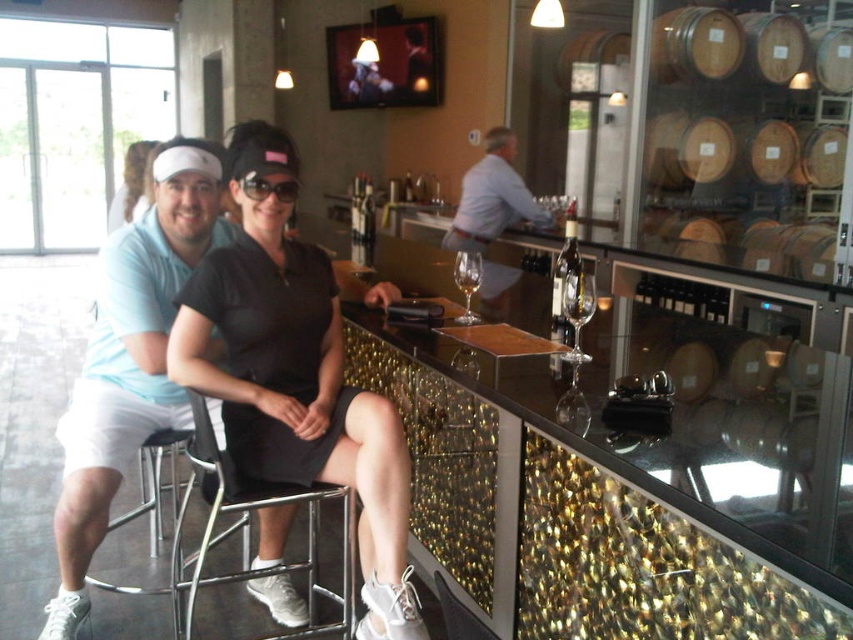
Is clear glass wine glass at center taller than clear glass wine at bar center?

Yes, clear glass wine glass at center is taller than clear glass wine at bar center.

From the picture: Is clear glass wine glass at center above clear glass wine at bar center?

Actually, clear glass wine glass at center is below clear glass wine at bar center.

Between point (585, 356) and point (454, 278), which one is positioned behind?

Point (454, 278)

I want to click on clear glass wine glass at center, so click(577, 308).

From the picture: How far apart are light blue shirt at center and clear glass wine glass at center?

light blue shirt at center is 9.92 feet away from clear glass wine glass at center.

Who is shorter, light blue shirt at center or clear glass wine glass at center?

Standing shorter between the two is clear glass wine glass at center.

Measure the distance between light blue shirt at center and camera.

They are 4.91 meters apart.

The image size is (853, 640). Find the location of `light blue shirt at center`. light blue shirt at center is located at coordinates (492, 196).

Does point (175, 260) come in front of point (560, 292)?

Yes.

Is light blue polo shirt at left to the right of translucent glass bottle at center from the viewer's perspective?

Incorrect, light blue polo shirt at left is not on the right side of translucent glass bottle at center.

Who is more forward, (119, 269) or (556, 301)?

Positioned in front is point (119, 269).

This screenshot has height=640, width=853. Find the location of `light blue polo shirt at left`. light blue polo shirt at left is located at coordinates (131, 358).